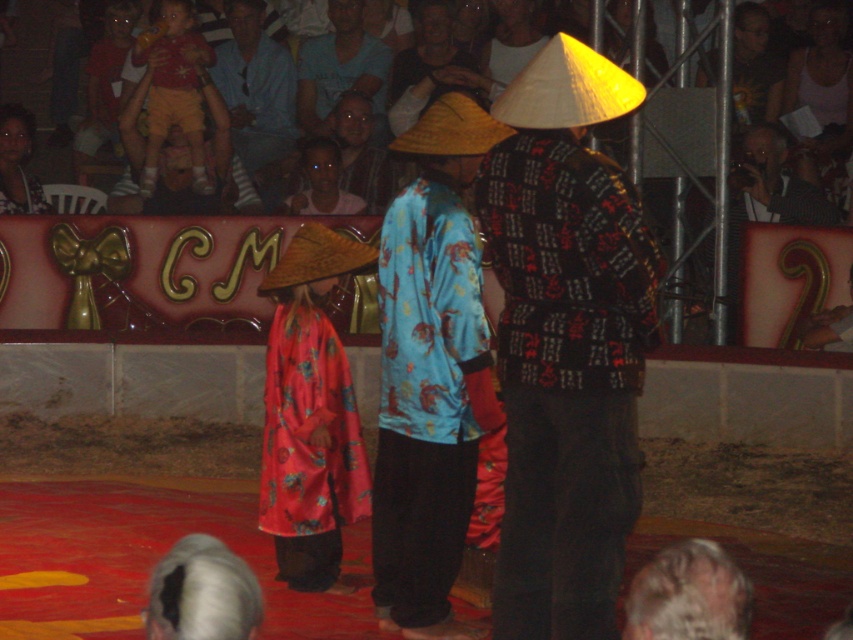
Who is positioned more to the right, patterned fabric robe at center or blue satin robe at center?

Positioned to the right is patterned fabric robe at center.

Describe the element at coordinates (566, 378) in the screenshot. I see `patterned fabric robe at center` at that location.

I want to click on patterned fabric robe at center, so click(566, 378).

Describe the element at coordinates (688, 595) in the screenshot. I see `gray hair at lower center` at that location.

At what (x,y) coordinates should I click in order to perform the action: click on gray hair at lower center. Please return your answer as a coordinate pair (x, y). The image size is (853, 640). Looking at the image, I should click on (688, 595).

Is patterned fabric robe at center positioned at the back of matte black conical hat at upper center?

No, patterned fabric robe at center is in front of matte black conical hat at upper center.

Is point (598, 540) closer to camera compared to point (492, 64)?

Yes, point (598, 540) is in front of point (492, 64).

What do you see at coordinates (566, 378) in the screenshot?
I see `patterned fabric robe at center` at bounding box center [566, 378].

The image size is (853, 640). I want to click on patterned fabric robe at center, so click(x=566, y=378).